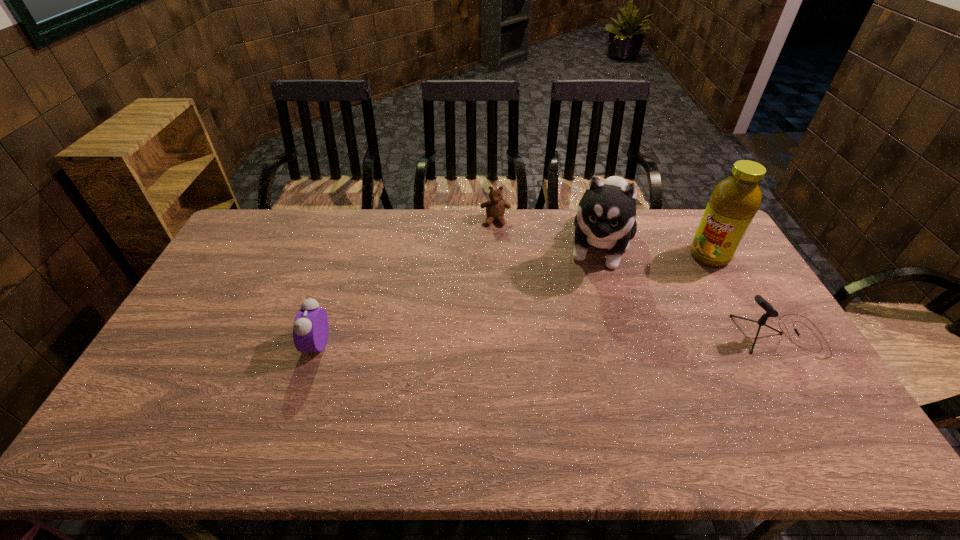
Image resolution: width=960 pixels, height=540 pixels. I want to click on microphone that is at the right edge, so click(x=770, y=311).

I want to click on fruit juice located at the right edge, so click(733, 203).

Where is `object that is at the far right corner`? This screenshot has width=960, height=540. object that is at the far right corner is located at coordinates (733, 203).

This screenshot has width=960, height=540. I want to click on vacant position at the far edge of the desktop, so click(420, 241).

In the image, there is a desktop. Where is `vacant space at the near edge`? The height and width of the screenshot is (540, 960). vacant space at the near edge is located at coordinates (308, 403).

Image resolution: width=960 pixels, height=540 pixels. In the image, there is a desktop. Identify the location of vacant area at the left edge. (253, 280).

Find the location of a particular element. The image size is (960, 540). vacant space at the right edge of the desktop is located at coordinates (776, 356).

Locate an element on the screen. vacant region at the far left corner of the desktop is located at coordinates (255, 240).

Find the location of a particular element. empty space between the microphone and the leftmost object is located at coordinates (548, 340).

This screenshot has width=960, height=540. I want to click on vacant region between the fourth object from right to left and the puppy, so 547,233.